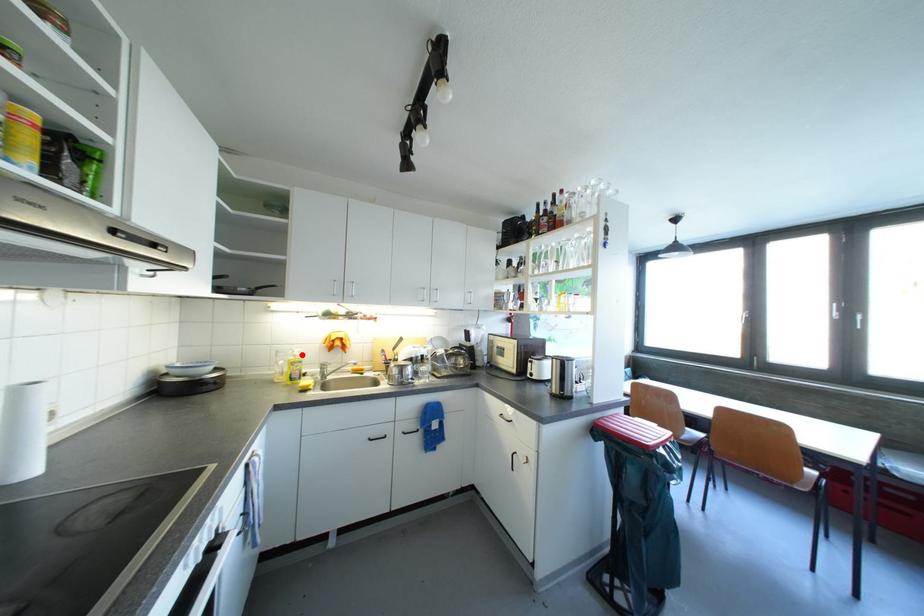
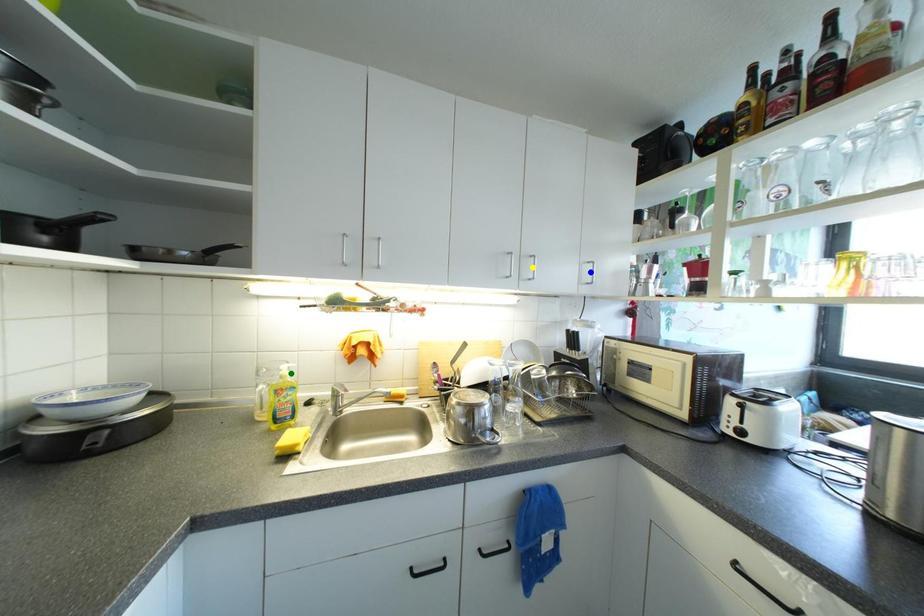
Question: I am providing you with two images of the same scene from different viewpoints. A red point is marked on the first image. You are given multiple points on the second image. Which point in image 2 is actually the same real-world point as the red point in image 1?

Choices:
 (A) yellow point
 (B) green point
 (C) blue point

Answer: (B)